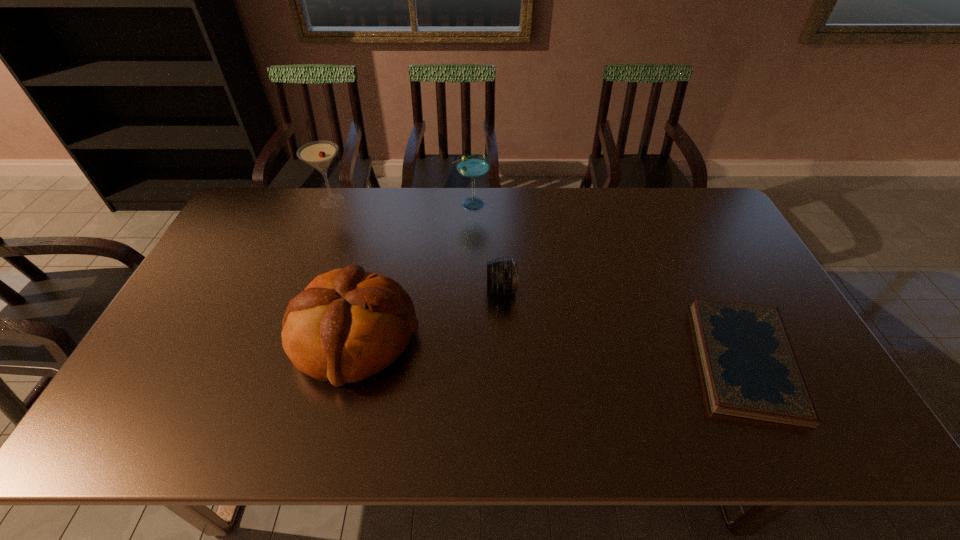
At what (x,y) coordinates should I click in order to perform the action: click on vacant region that satisfies the following two spatial constraints: 1. at the front element of the paperback book; 2. on the left side of the telephoto lens. Please return your answer as a coordinate pair (x, y). This screenshot has height=540, width=960. Looking at the image, I should click on (505, 360).